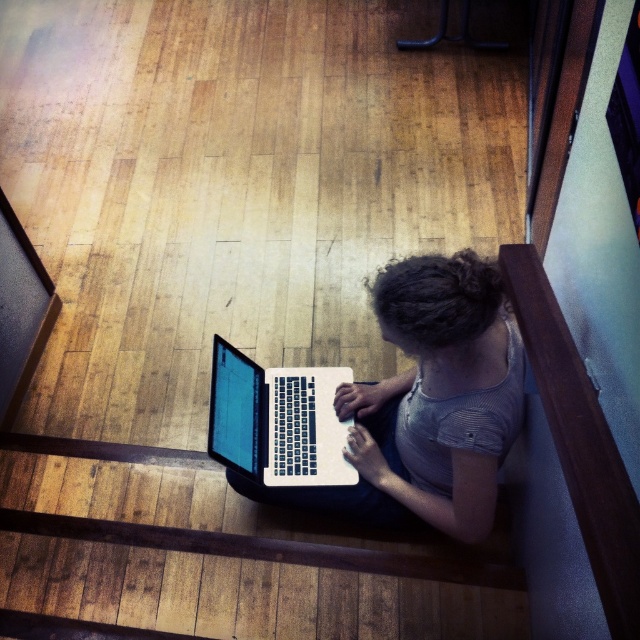
Can you confirm if white matte laptop at center is positioned to the right of white glossy laptop at lower center?

Correct, you'll find white matte laptop at center to the right of white glossy laptop at lower center.

Does white matte laptop at center have a lesser height compared to white glossy laptop at lower center?

In fact, white matte laptop at center may be taller than white glossy laptop at lower center.

Identify the location of white matte laptop at center. The width and height of the screenshot is (640, 640). (428, 403).